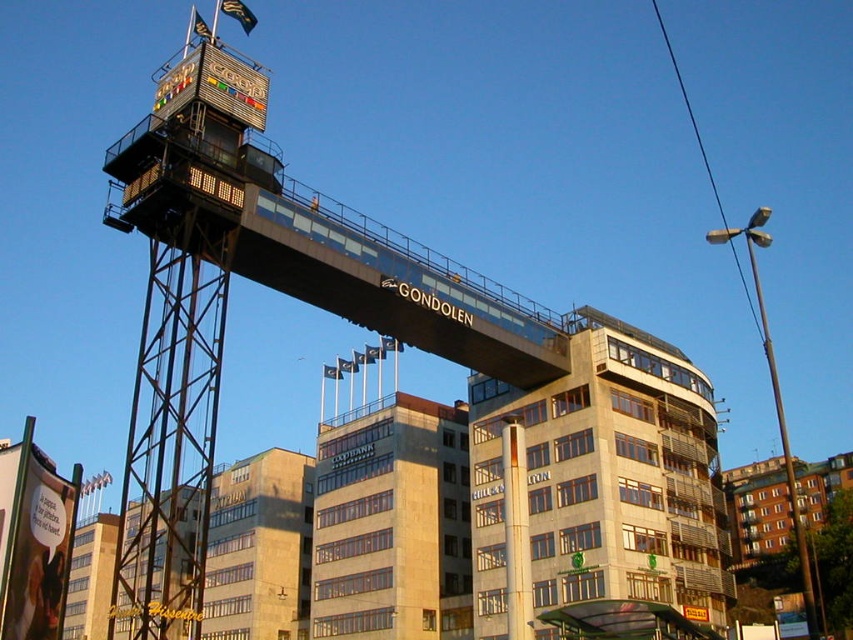
Does beige concrete building at center have a lesser height compared to beige stone building at center?

No, beige concrete building at center is not shorter than beige stone building at center.

Can you confirm if beige concrete building at center is positioned below beige stone building at center?

No, beige concrete building at center is not below beige stone building at center.

Which is in front, point (590, 536) or point (370, 580)?

Positioned in front is point (590, 536).

This screenshot has height=640, width=853. Identify the location of beige concrete building at center. (604, 480).

Does metallic gondola at upper center have a lesser height compared to beige stone building at center?

No.

Image resolution: width=853 pixels, height=640 pixels. Describe the element at coordinates (181, 317) in the screenshot. I see `metallic gondola at upper center` at that location.

Is point (190, 548) behind point (428, 625)?

Yes, it is.

The image size is (853, 640). Identify the location of metallic gondola at upper center. (181, 317).

Does beige stone building at center have a larger size compared to metallic glass bridge at center?

Yes, beige stone building at center is bigger than metallic glass bridge at center.

From the picture: Who is taller, beige stone building at center or metallic glass bridge at center?

With more height is beige stone building at center.

Describe the element at coordinates (392, 522) in the screenshot. I see `beige stone building at center` at that location.

Locate an element on the screen. beige stone building at center is located at coordinates [x=392, y=522].